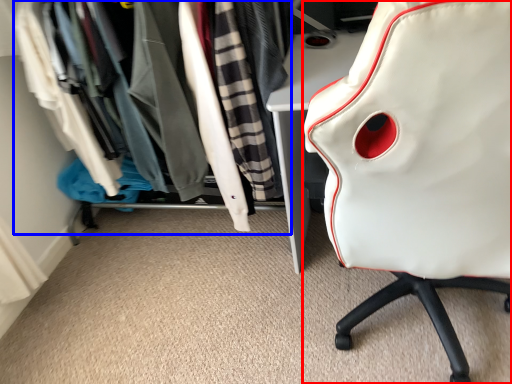
Question: Which point is closer to the camera, chair (highlighted by a red box) or closet (highlighted by a blue box)?

Choices:
 (A) chair
 (B) closet

Answer: (A)